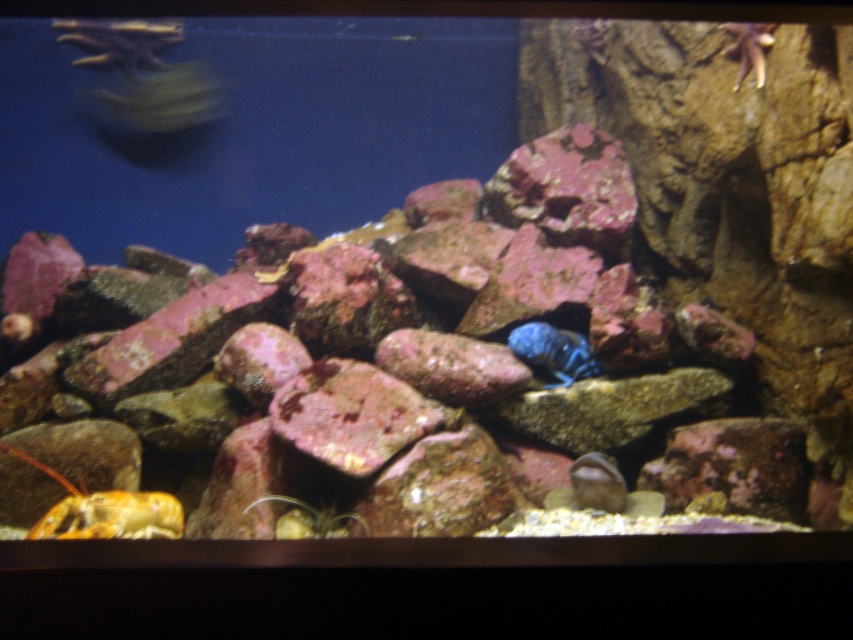
You are an underwater explorer who needs to locate the shiny orange hermit crab at lower left. Based on the coordinates provided, where should you look in the aquarium?

The shiny orange hermit crab at lower left is located at coordinates point (103, 509).

You are an underwater explorer looking for the shiny orange hermit crab at lower left and the matte brown rock at lower center. According to the scene, which object is positioned more to the left?

The shiny orange hermit crab at lower left is positioned more to the left than the matte brown rock at lower center.

You are an aquatic creature trying to hide from predators. You see a blue glossy fish at center and a matte brown rock at lower center. Which object is larger and can provide better cover?

The blue glossy fish at center is bigger than the matte brown rock at lower center, so it can provide better cover.